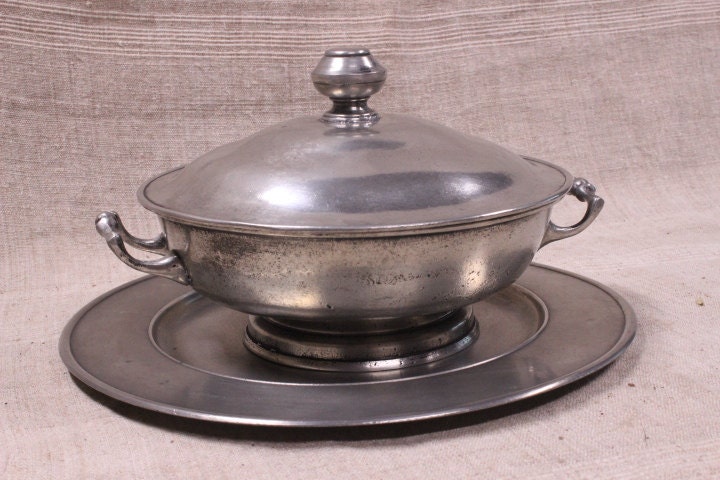
Locate an element on the screen. Image resolution: width=720 pixels, height=480 pixels. textile backdrop is located at coordinates (130, 86), (18, 323), (636, 402), (633, 83).